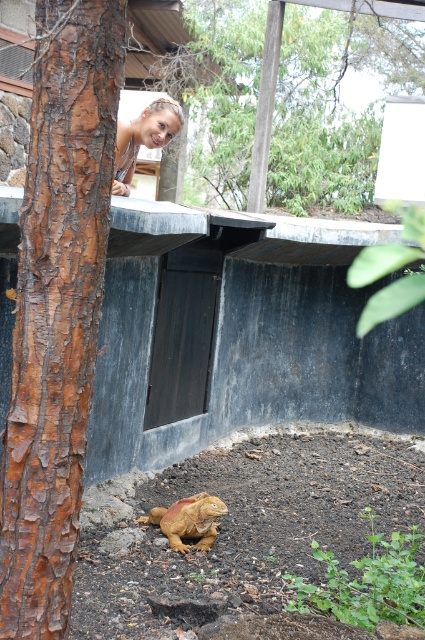
You are a photographer standing 10 feet away from the blonde hair at upper center. Can you see the brown rough bark at left without moving your position?

The brown rough bark at left is 10.66 feet from blonde hair at upper center. Since you are standing 10 feet away from the blonde hair at upper center, the distance between you and the brown rough bark at left would be approximately 20.66 feet. Therefore, you cannot see the brown rough bark at left without moving your position.

You are standing in the outdoor scene and want to take a photo of the woman without the brown rough bark at left blocking the view. Where should you move to ensure the bark is out of frame?

Move to the right side of the scene away from the brown rough bark at left to avoid it blocking the view of the woman.